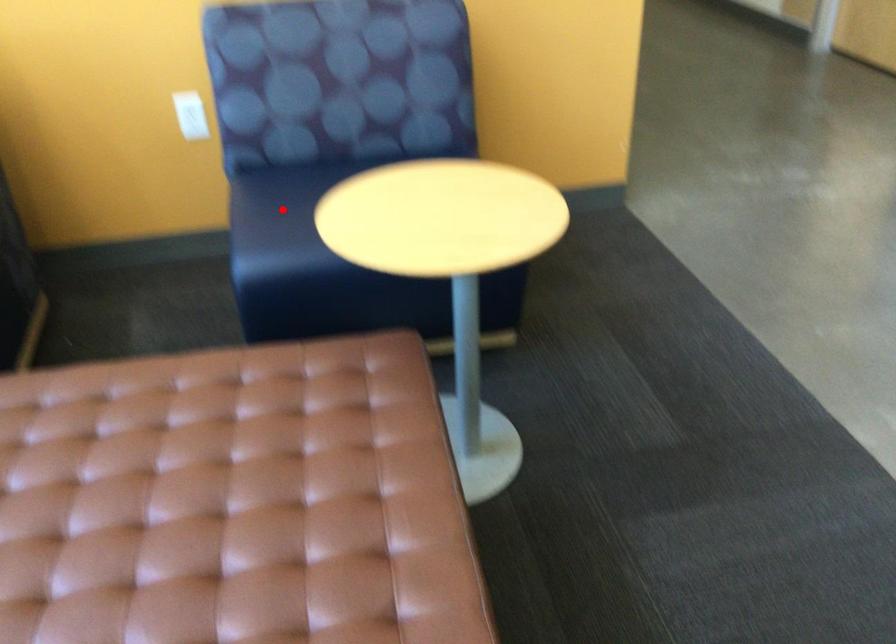
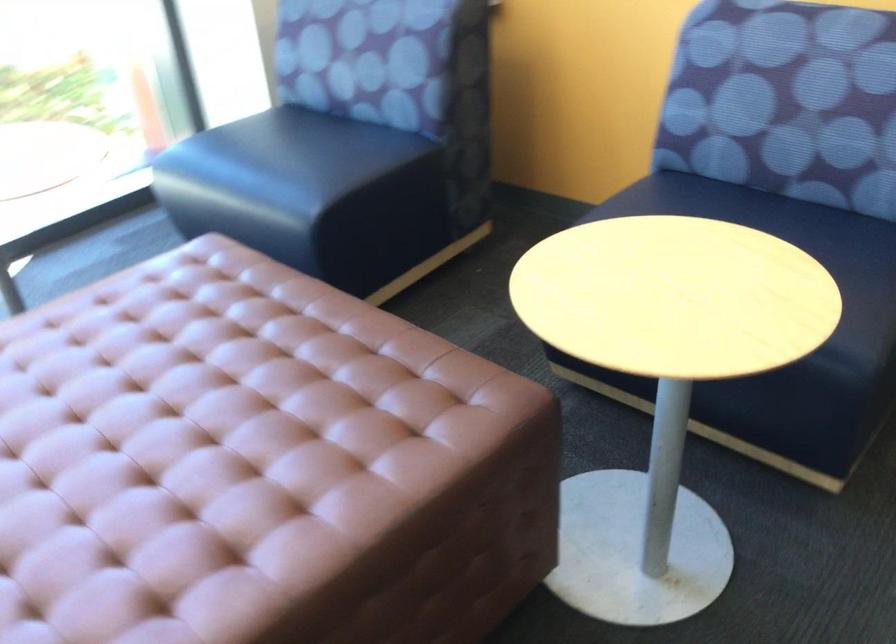
Question: I am providing you with two images of the same scene from different viewpoints. A red point is marked on the first image. At the location where the point appears in image 1, is it still visible in image 2?

Choices:
 (A) Yes
 (B) No

Answer: (B)